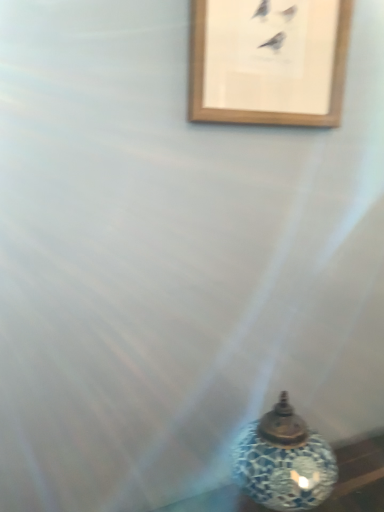
The image size is (384, 512). Describe the element at coordinates (284, 461) in the screenshot. I see `blue mosaic oil lamp at lower right` at that location.

In order to click on blue mosaic oil lamp at lower right in this screenshot , I will do `click(284, 461)`.

The width and height of the screenshot is (384, 512). Identify the location of wooden picture frame at upper center. (268, 61).

This screenshot has height=512, width=384. What do you see at coordinates (268, 61) in the screenshot? I see `wooden picture frame at upper center` at bounding box center [268, 61].

Locate an element on the screen. The image size is (384, 512). blue mosaic oil lamp at lower right is located at coordinates (284, 461).

Can you confirm if wooden picture frame at upper center is positioned to the left of blue mosaic oil lamp at lower right?

Yes, wooden picture frame at upper center is to the left of blue mosaic oil lamp at lower right.

In the image, is wooden picture frame at upper center positioned in front of or behind blue mosaic oil lamp at lower right?

Clearly, wooden picture frame at upper center is behind blue mosaic oil lamp at lower right.

Between point (258, 75) and point (321, 454), which one is positioned in front?

The point (321, 454) is in front.

From the image's perspective, is wooden picture frame at upper center on blue mosaic oil lamp at lower right?

Yes, from the image's perspective, wooden picture frame at upper center is on top of blue mosaic oil lamp at lower right.

From a real-world perspective, relative to blue mosaic oil lamp at lower right, is wooden picture frame at upper center vertically above or below?

wooden picture frame at upper center is situated higher than blue mosaic oil lamp at lower right in the real world.

Which of these two, wooden picture frame at upper center or blue mosaic oil lamp at lower right, is thinner?

Thinner between the two is wooden picture frame at upper center.

Considering the relative sizes of wooden picture frame at upper center and blue mosaic oil lamp at lower right in the image provided, is wooden picture frame at upper center taller than blue mosaic oil lamp at lower right?

No, wooden picture frame at upper center is not taller than blue mosaic oil lamp at lower right.

Can you confirm if wooden picture frame at upper center is smaller than blue mosaic oil lamp at lower right?

Correct, wooden picture frame at upper center occupies less space than blue mosaic oil lamp at lower right.

Is blue mosaic oil lamp at lower right a part of wooden picture frame at upper center?

No.

Would you consider wooden picture frame at upper center to be distant from blue mosaic oil lamp at lower right?

Actually, wooden picture frame at upper center and blue mosaic oil lamp at lower right are a little close together.

Could you tell me if wooden picture frame at upper center is turned towards blue mosaic oil lamp at lower right?

No, wooden picture frame at upper center is not aimed at blue mosaic oil lamp at lower right.

I want to click on oil lamp below the wooden picture frame at upper center (from the image's perspective), so click(284, 461).

Is blue mosaic oil lamp at lower right to the right of wooden picture frame at upper center from the viewer's perspective?

Correct, you'll find blue mosaic oil lamp at lower right to the right of wooden picture frame at upper center.

Consider the image. Which object is further away from the camera taking this photo, blue mosaic oil lamp at lower right or wooden picture frame at upper center?

wooden picture frame at upper center is further away from the camera.

Which point is more distant from viewer, [282,501] or [207,95]?

The point [207,95] is more distant.

From the image's perspective, is blue mosaic oil lamp at lower right located beneath wooden picture frame at upper center?

Yes, from the image's perspective, blue mosaic oil lamp at lower right is beneath wooden picture frame at upper center.

From a real-world perspective, does blue mosaic oil lamp at lower right stand above wooden picture frame at upper center?

No, from a real-world perspective, blue mosaic oil lamp at lower right is not on top of wooden picture frame at upper center.

In the scene shown: Which of these two, blue mosaic oil lamp at lower right or wooden picture frame at upper center, is wider?

blue mosaic oil lamp at lower right.

Considering the relative sizes of blue mosaic oil lamp at lower right and wooden picture frame at upper center in the image provided, is blue mosaic oil lamp at lower right shorter than wooden picture frame at upper center?

Incorrect, the height of blue mosaic oil lamp at lower right does not fall short of that of wooden picture frame at upper center.

Is blue mosaic oil lamp at lower right bigger or smaller than wooden picture frame at upper center?

Considering their sizes, blue mosaic oil lamp at lower right takes up more space than wooden picture frame at upper center.

Is blue mosaic oil lamp at lower right outside of wooden picture frame at upper center?

Yes, blue mosaic oil lamp at lower right is located beyond the bounds of wooden picture frame at upper center.

Are blue mosaic oil lamp at lower right and wooden picture frame at upper center far apart?

No.

Is blue mosaic oil lamp at lower right positioned with its back to wooden picture frame at upper center?

That's not correct — blue mosaic oil lamp at lower right is not looking away from wooden picture frame at upper center.

How many degrees apart are the facing directions of blue mosaic oil lamp at lower right and wooden picture frame at upper center?

1.58 degrees separate the facing orientations of blue mosaic oil lamp at lower right and wooden picture frame at upper center.

Where is `picture frame above the blue mosaic oil lamp at lower right (from the image's perspective)`? picture frame above the blue mosaic oil lamp at lower right (from the image's perspective) is located at coordinates (268, 61).

The image size is (384, 512). Find the location of `oil lamp beneath the wooden picture frame at upper center (from a real-world perspective)`. oil lamp beneath the wooden picture frame at upper center (from a real-world perspective) is located at coordinates (284, 461).

At what (x,y) coordinates should I click in order to perform the action: click on oil lamp lying in front of the wooden picture frame at upper center. Please return your answer as a coordinate pair (x, y). Looking at the image, I should click on (284, 461).